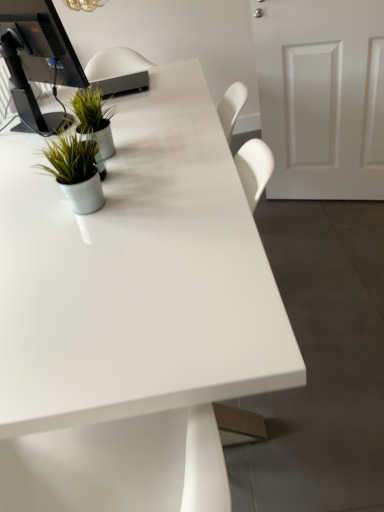
Locate an element on the screen. vacant region in front of green matte plant at upper left, marked as the second houseplant in a front-to-back arrangement is located at coordinates (111, 172).